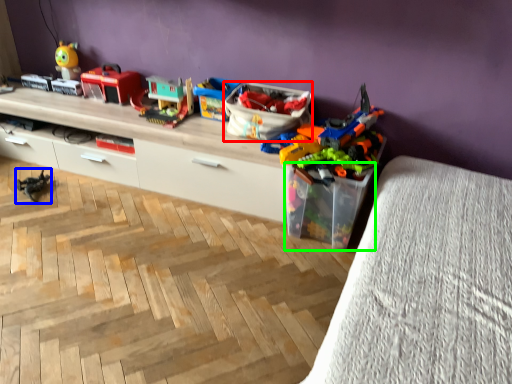
Question: Which is farther away from storage box (highlighted by a red box)? toy (highlighted by a blue box) or storage box (highlighted by a green box)?

Choices:
 (A) toy
 (B) storage box

Answer: (A)